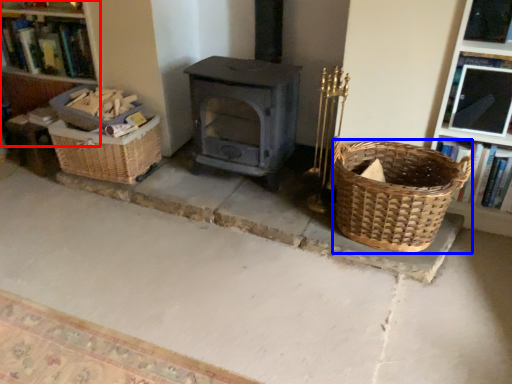
Question: Which of the following is the farthest to the observer, bookshelf (highlighted by a red box) or basket (highlighted by a blue box)?

Choices:
 (A) bookshelf
 (B) basket

Answer: (A)